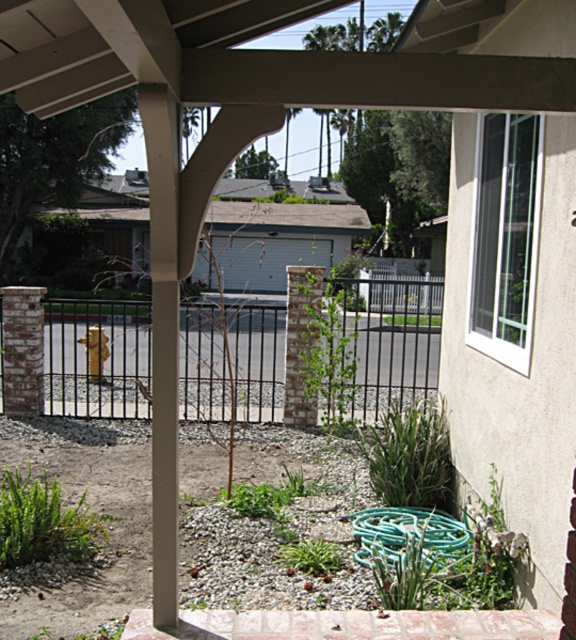
Is point (134, 388) positioned before point (358, 538)?

No, (134, 388) is behind (358, 538).

Does black metal fence at center come behind green rubber hose at lower center?

Yes, black metal fence at center is behind green rubber hose at lower center.

At what (x,y) coordinates should I click in order to perform the action: click on black metal fence at center. Please return your answer as a coordinate pair (x, y). This screenshot has height=640, width=576. Looking at the image, I should click on (382, 344).

In order to click on black metal fence at center in this screenshot , I will do `click(382, 344)`.